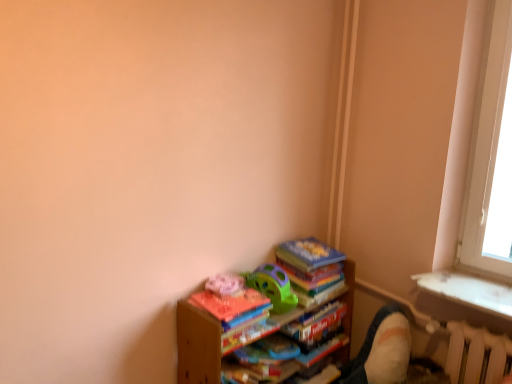
Question: Is velvet beige swivel chair at lower right far away from wooden books at lower right?

Choices:
 (A) no
 (B) yes

Answer: (A)

Question: From the image's perspective, is velvet beige swivel chair at lower right above wooden books at lower right?

Choices:
 (A) no
 (B) yes

Answer: (A)

Question: Is velvet beige swivel chair at lower right turned away from wooden books at lower right?

Choices:
 (A) yes
 (B) no

Answer: (B)

Question: Is the surface of velvet beige swivel chair at lower right in direct contact with wooden books at lower right?

Choices:
 (A) yes
 (B) no

Answer: (B)

Question: Is velvet beige swivel chair at lower right further to camera compared to wooden books at lower right?

Choices:
 (A) yes
 (B) no

Answer: (A)

Question: Is green plastic toy at center to the left or to the right of white plastic radiator at lower right in the image?

Choices:
 (A) left
 (B) right

Answer: (A)

Question: Looking at the image, does green plastic toy at center seem bigger or smaller compared to white plastic radiator at lower right?

Choices:
 (A) small
 (B) big

Answer: (A)

Question: Considering the positions of green plastic toy at center and white plastic radiator at lower right in the image, is green plastic toy at center taller or shorter than white plastic radiator at lower right?

Choices:
 (A) short
 (B) tall

Answer: (A)

Question: From a real-world perspective, is green plastic toy at center positioned above or below white plastic radiator at lower right?

Choices:
 (A) below
 (B) above

Answer: (B)

Question: Is point (283, 301) closer or farther from the camera than point (381, 372)?

Choices:
 (A) farther
 (B) closer

Answer: (B)

Question: From the image's perspective, is green plastic toy at center located above or below velvet beige swivel chair at lower right?

Choices:
 (A) below
 (B) above

Answer: (B)

Question: In terms of size, does green plastic toy at center appear bigger or smaller than velvet beige swivel chair at lower right?

Choices:
 (A) big
 (B) small

Answer: (B)

Question: Considering the positions of green plastic toy at center and velvet beige swivel chair at lower right in the image, is green plastic toy at center taller or shorter than velvet beige swivel chair at lower right?

Choices:
 (A) tall
 (B) short

Answer: (B)

Question: Is point tap(457, 372) closer or farther from the camera than point tap(266, 294)?

Choices:
 (A) farther
 (B) closer

Answer: (A)

Question: Considering the positions of white plastic radiator at lower right and green plastic toy at center in the image, is white plastic radiator at lower right bigger or smaller than green plastic toy at center?

Choices:
 (A) big
 (B) small

Answer: (A)